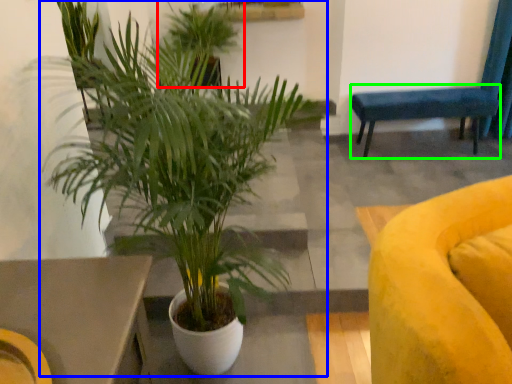
Question: Considering the real-world distances, which object is closest to houseplant (highlighted by a red box)? houseplant (highlighted by a blue box) or armchair (highlighted by a green box).

Choices:
 (A) houseplant
 (B) armchair

Answer: (B)